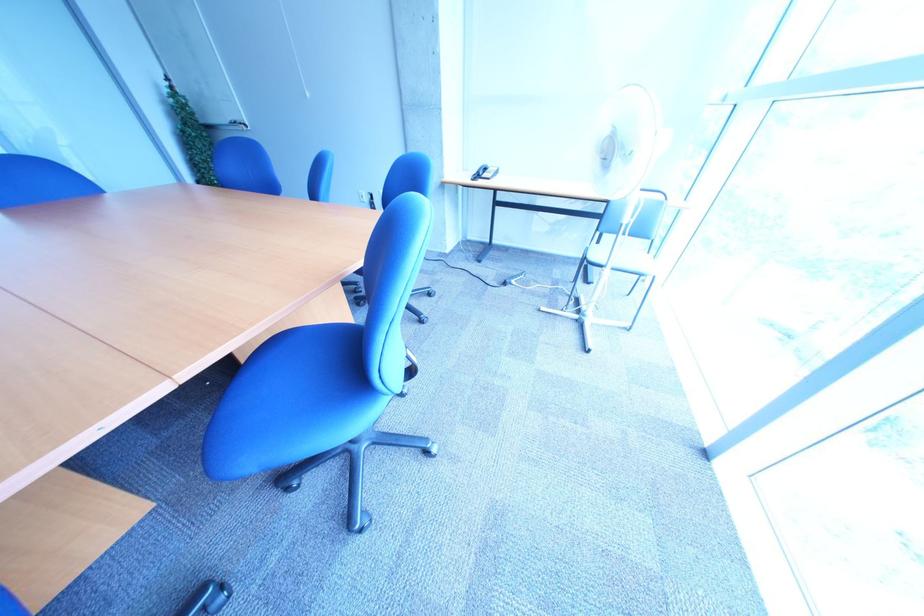
Describe the element at coordinates (304, 387) in the screenshot. The height and width of the screenshot is (616, 924). I see `a chair sitting surface` at that location.